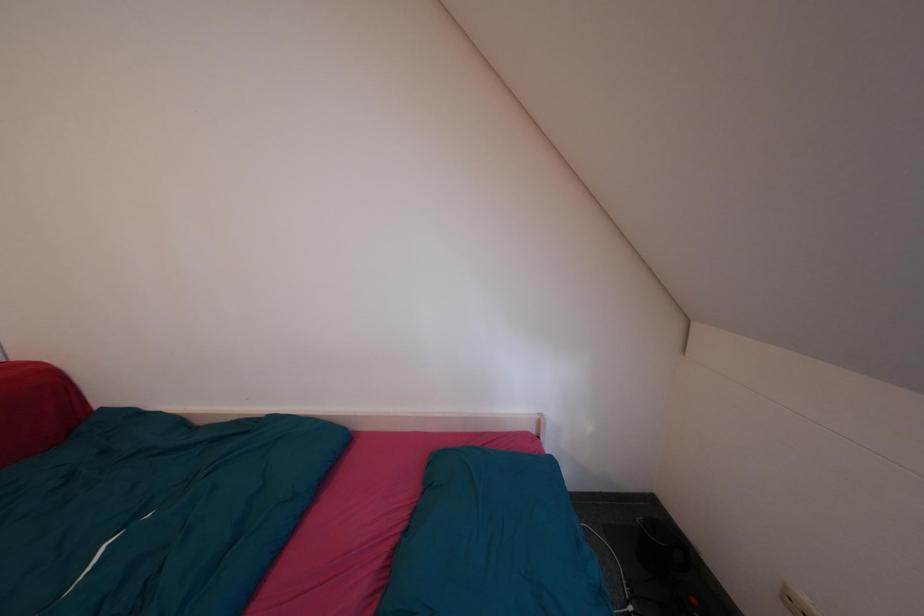
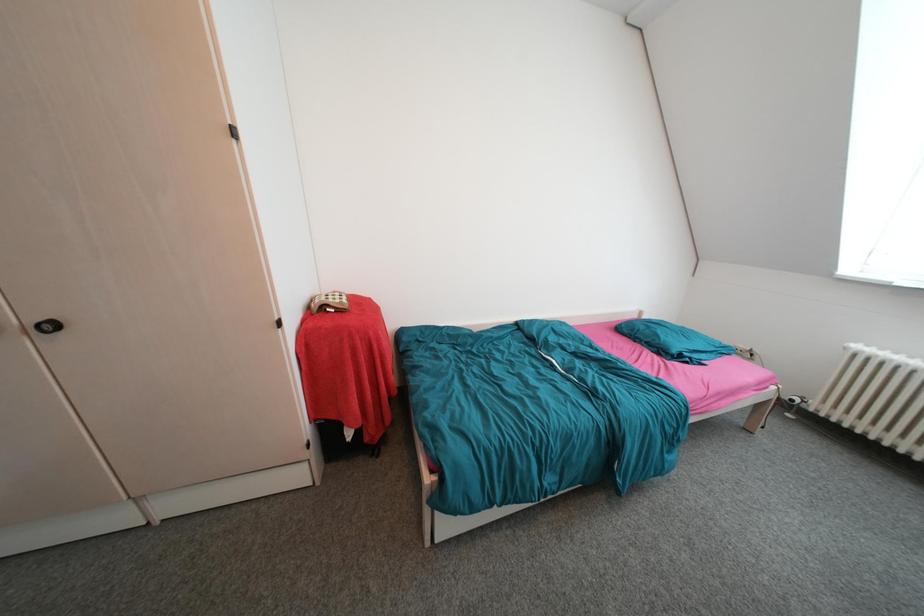
Question: What movement of the cameraman would produce the second image?

Choices:
 (A) Left
 (B) Right
 (C) Forward
 (D) Backward

Answer: (A)